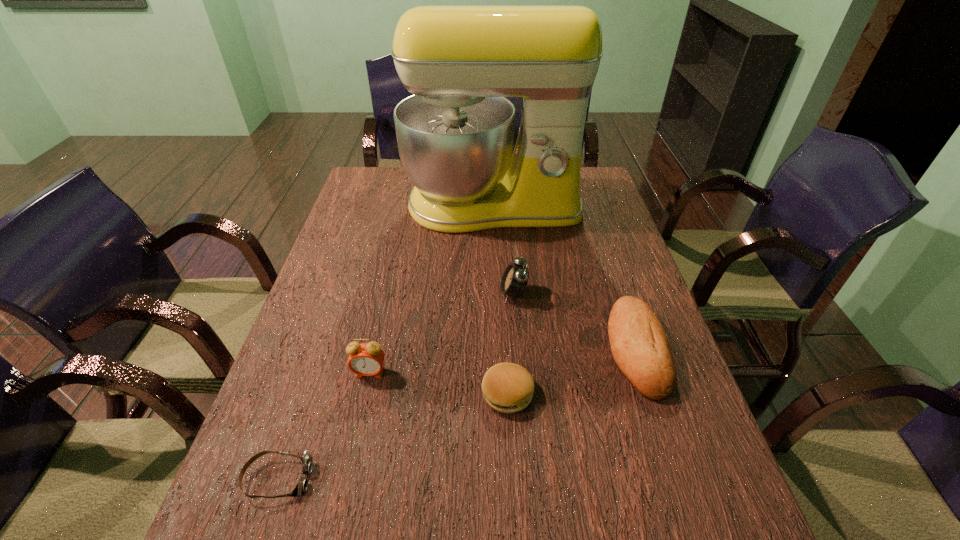
Find the location of a particular element. This screenshot has width=960, height=540. mixer is located at coordinates (455, 134).

Find the location of a particular element. the tallest object is located at coordinates [x=455, y=134].

You are a GUI agent. You are given a task and a screenshot of the screen. Output one action in this format:
    pyautogui.click(x=<x>, y=<y>)
    Task: Click on the farther alarm clock
    The image size is (960, 540).
    Given the screenshot: What is the action you would take?
    pyautogui.click(x=514, y=280)

Identify the location of the right alarm clock. This screenshot has width=960, height=540. (514, 280).

What are the coordinates of `the left alarm clock` in the screenshot? It's located at click(366, 359).

Image resolution: width=960 pixels, height=540 pixels. In order to click on the fourth tallest object in this screenshot , I will do (x=640, y=347).

Where is `the fifth tallest object`? The width and height of the screenshot is (960, 540). the fifth tallest object is located at coordinates (508, 388).

Locate an element on the screen. The height and width of the screenshot is (540, 960). the nearest object is located at coordinates (307, 460).

I want to click on goggles, so click(x=307, y=460).

Image resolution: width=960 pixels, height=540 pixels. What are the coordinates of `vacant area located 0.250m on the side of the farthest object with the control knob` in the screenshot? It's located at (496, 294).